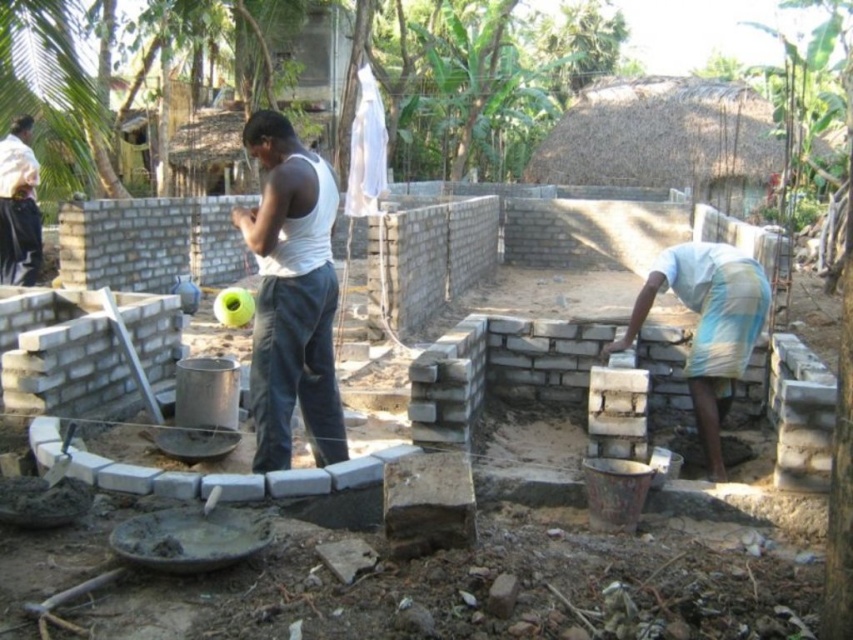
How much distance is there between light blue plaid shorts at lower right and white cotton shirt at upper left?

The distance of light blue plaid shorts at lower right from white cotton shirt at upper left is 6.30 meters.

Based on the photo, which is below, light blue plaid shorts at lower right or white cotton shirt at upper left?

light blue plaid shorts at lower right

At what (x,y) coordinates should I click in order to perform the action: click on light blue plaid shorts at lower right. Please return your answer as a coordinate pair (x, y). The width and height of the screenshot is (853, 640). Looking at the image, I should click on (708, 324).

Which is above, white matte tank top at center or light blue plaid shorts at lower right?

Positioned higher is white matte tank top at center.

What do you see at coordinates (291, 296) in the screenshot?
I see `white matte tank top at center` at bounding box center [291, 296].

Image resolution: width=853 pixels, height=640 pixels. What are the coordinates of `white matte tank top at center` in the screenshot? It's located at (291, 296).

Between point (412, 419) and point (19, 234), which one is positioned behind?

Positioned behind is point (19, 234).

Locate an element on the screen. This screenshot has width=853, height=640. gray brick wall at center is located at coordinates (502, 369).